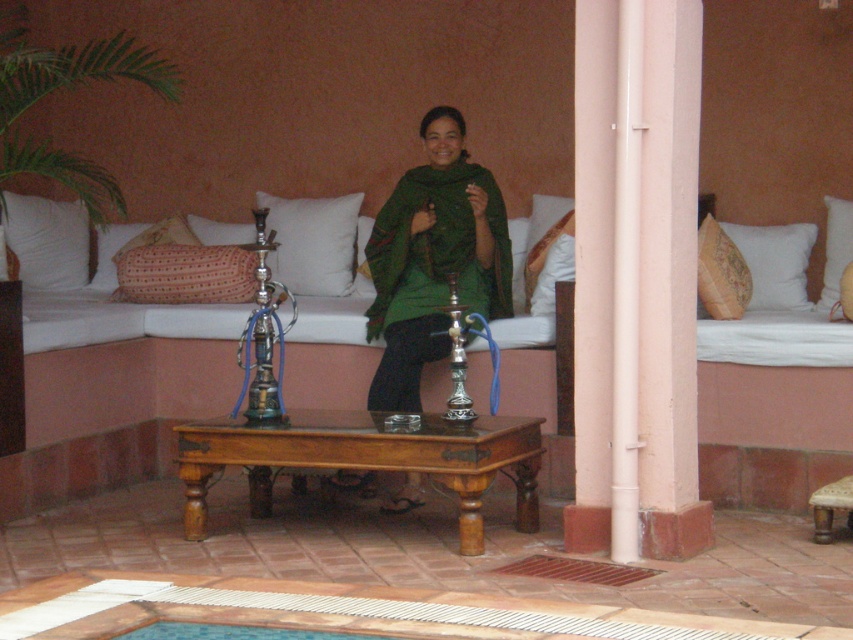
Question: Which is nearer to the white soft pillow at upper left?

Choices:
 (A) white soft cushion at center
 (B) textured beige pillow at center
 (C) beige textured pillow at right

Answer: (A)

Question: In this image, where is patterned fabric pillow at right located relative to knitted fabric pillow at center?

Choices:
 (A) below
 (B) above

Answer: (A)

Question: Can you confirm if white smooth pillar at center is positioned to the left of textured beige pillow at center?

Choices:
 (A) no
 (B) yes

Answer: (A)

Question: Which point appears farthest from the camera in this image?

Choices:
 (A) (834, 225)
 (B) (433, 122)
 (C) (750, 296)

Answer: (A)

Question: Does textured beige pillow at center lie behind beige textured pillow at right?

Choices:
 (A) no
 (B) yes

Answer: (A)

Question: Which object appears farthest from the camera in this image?

Choices:
 (A) white soft cushion at right
 (B) white smooth pillar at center
 (C) white soft cushion at center
 (D) beige textured pillow at right

Answer: (C)